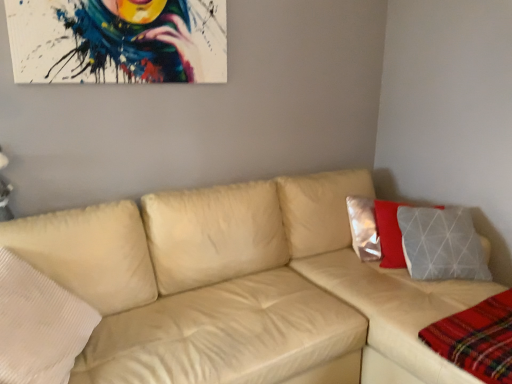
Question: In the image, is plaid fabric at lower right positioned in front of or behind beige leather couch at center?

Choices:
 (A) front
 (B) behind

Answer: (B)

Question: In terms of size, does plaid fabric at lower right appear bigger or smaller than beige leather couch at center?

Choices:
 (A) small
 (B) big

Answer: (A)

Question: Does point (493, 337) appear closer or farther from the camera than point (9, 248)?

Choices:
 (A) closer
 (B) farther

Answer: (A)

Question: In terms of height, does beige leather couch at center look taller or shorter compared to plaid fabric at lower right?

Choices:
 (A) tall
 (B) short

Answer: (A)

Question: Considering the positions of beige leather couch at center and plaid fabric at lower right in the image, is beige leather couch at center wider or thinner than plaid fabric at lower right?

Choices:
 (A) wide
 (B) thin

Answer: (A)

Question: Would you say beige leather couch at center is inside or outside plaid fabric at lower right?

Choices:
 (A) inside
 (B) outside

Answer: (B)

Question: In the image, is beige leather couch at center positioned in front of or behind plaid fabric at lower right?

Choices:
 (A) behind
 (B) front

Answer: (B)